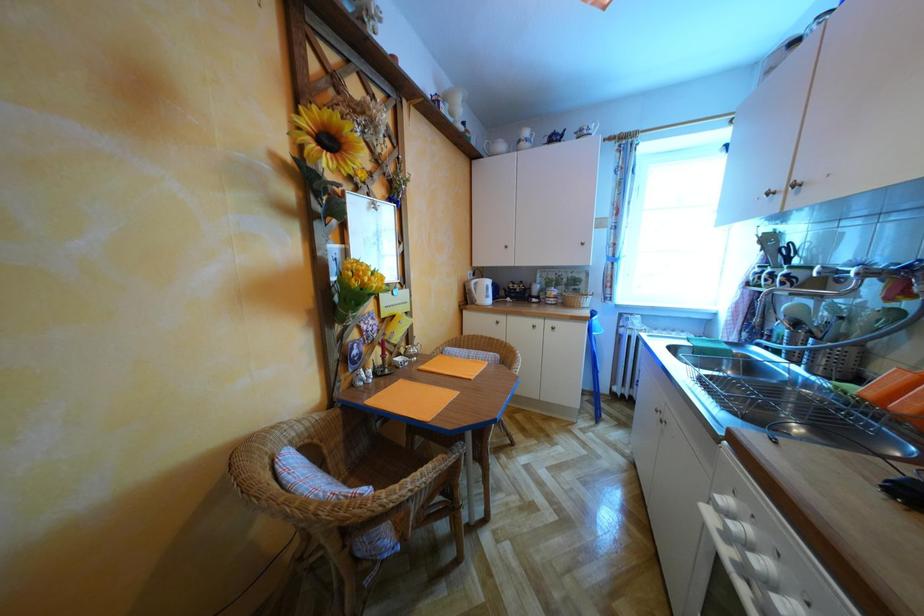
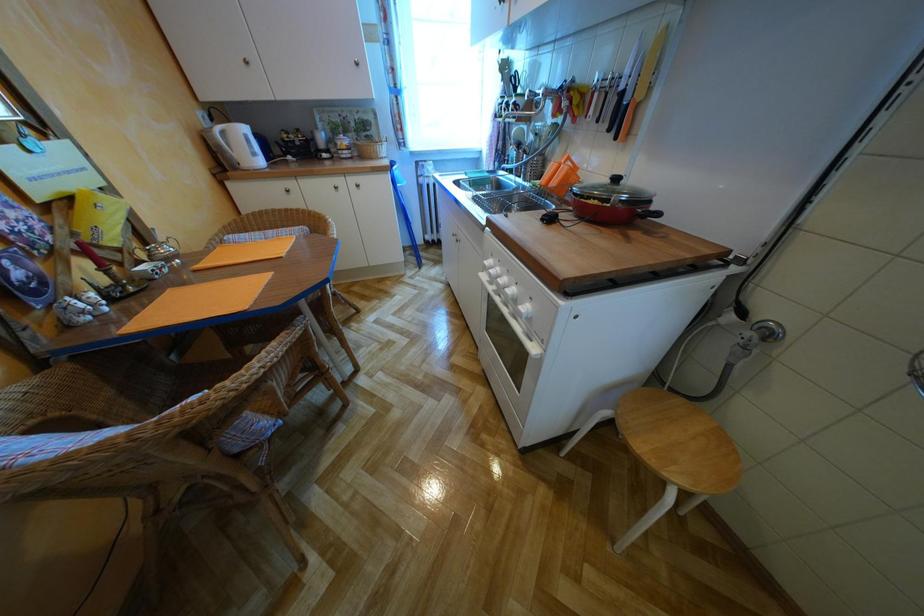
The images are taken continuously from a first-person perspective. In which direction is your viewpoint rotating?

The camera's rotation is toward right-down.